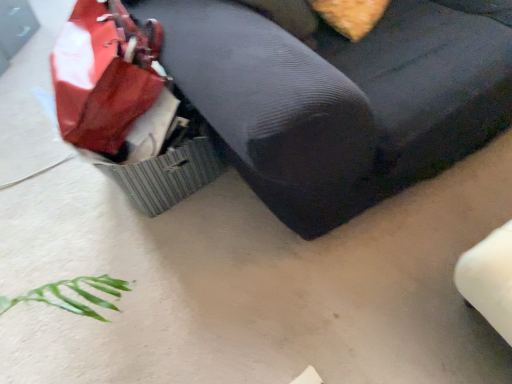
Question: Should I look upward or downward to see textured fabric ottoman at center?

Choices:
 (A) down
 (B) up

Answer: (B)